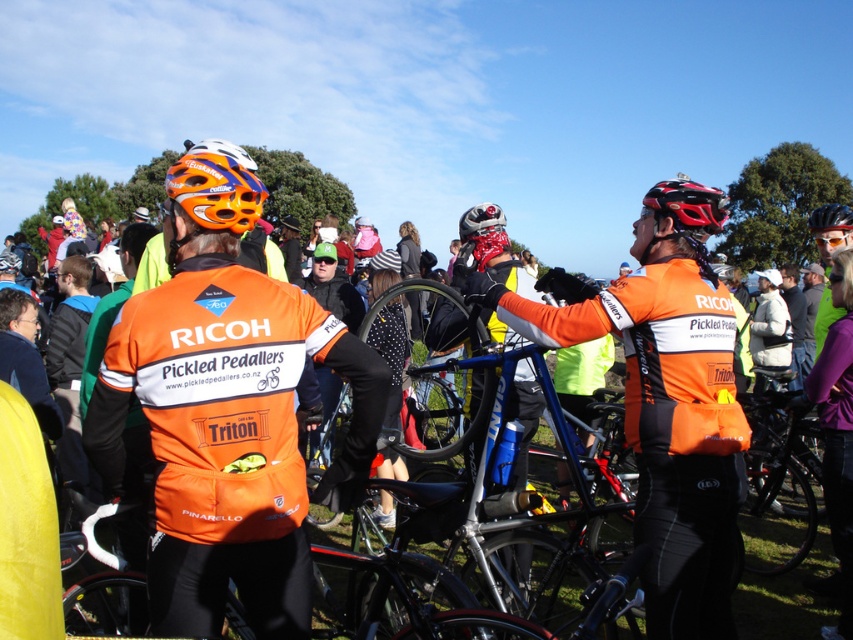
Is point (721, 557) more distant than point (224, 209)?

Yes.

Can you confirm if orange jersey at center is smaller than orange matte bicycle helmet at upper left?

No, orange jersey at center is not smaller than orange matte bicycle helmet at upper left.

Who is more forward, (712, 404) or (190, 216)?

Point (190, 216) is in front.

At what (x,y) coordinates should I click in order to perform the action: click on orange jersey at center. Please return your answer as a coordinate pair (x, y). Looking at the image, I should click on (664, 397).

Can you confirm if orange matte helmet at upper left is wider than matte orange goggles at center?

Yes, orange matte helmet at upper left is wider than matte orange goggles at center.

Which is more to the left, orange matte helmet at upper left or matte orange goggles at center?

Positioned to the left is matte orange goggles at center.

Who is more distant from viewer, [293,573] or [320,259]?

The point [320,259] is more distant.

Where is `orange matte helmet at upper left`? The height and width of the screenshot is (640, 853). orange matte helmet at upper left is located at coordinates (225, 413).

Which is behind, point (643, 196) or point (312, 262)?

The point (643, 196) is behind.

Can you confirm if shiny black helmet at upper right is shorter than matte orange goggles at center?

No.

Image resolution: width=853 pixels, height=640 pixels. Identify the location of shiny black helmet at upper right. (685, 209).